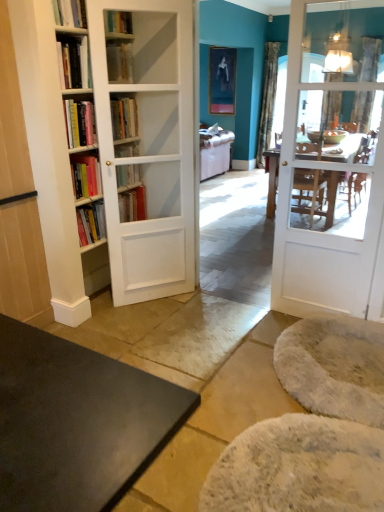
At what (x,y) coordinates should I click in order to perform the action: click on free space that is in between white glossy bookcase at left and white fluffy yoga mat at lower right, the second yoga mat positioned from the front. Please return your answer as a coordinate pair (x, y). The height and width of the screenshot is (512, 384). Looking at the image, I should click on (209, 329).